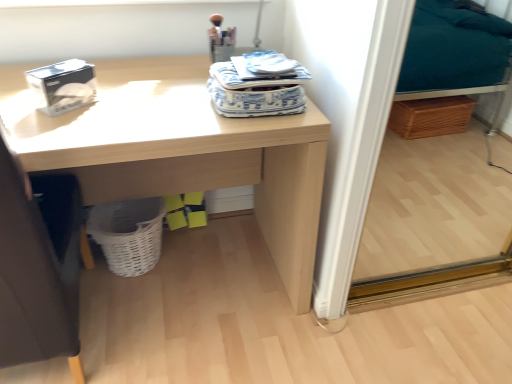
Identify the location of free space in front of yellow matte box at lower center, the first box in the bottom-to-top sequence. This screenshot has height=384, width=512. (187, 246).